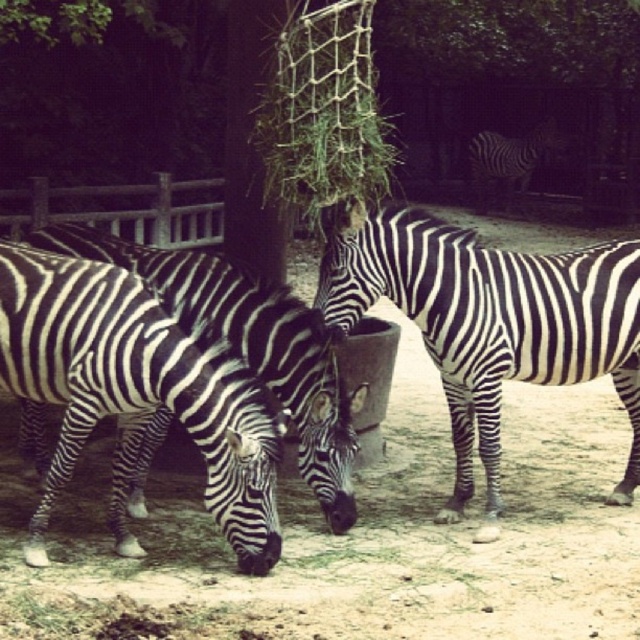
Describe the element at coordinates (134, 394) in the screenshot. I see `black and white striped zebra at lower left` at that location.

Which is behind, point (134, 320) or point (515, 310)?

The point (515, 310) is behind.

This screenshot has height=640, width=640. I want to click on black and white striped zebra at lower left, so click(134, 394).

Who is positioned more to the right, black and white striped zebra at lower left or black and white stripes at center?

black and white stripes at center is more to the right.

Does black and white striped zebra at lower left appear on the left side of black and white stripes at center?

Indeed, black and white striped zebra at lower left is positioned on the left side of black and white stripes at center.

Locate an element on the screen. The image size is (640, 640). black and white striped zebra at lower left is located at coordinates (134, 394).

Where is `black and white striped zebra at lower left`? The height and width of the screenshot is (640, 640). black and white striped zebra at lower left is located at coordinates (134, 394).

Does black and white striped zebra at center appear on the right side of black and white stripes at center?

In fact, black and white striped zebra at center is to the left of black and white stripes at center.

From the picture: Between black and white striped zebra at center and black and white stripes at center, which one has more height?

Standing taller between the two is black and white stripes at center.

Find the location of `black and white striped zebra at center`. black and white striped zebra at center is located at coordinates (492, 321).